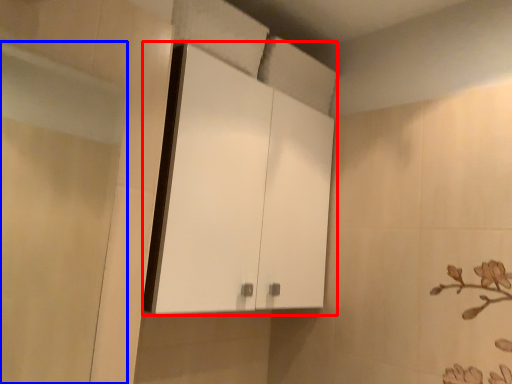
Question: Among these objects, which one is nearest to the camera, cabinetry (highlighted by a red box) or screen door (highlighted by a blue box)?

Choices:
 (A) cabinetry
 (B) screen door

Answer: (B)